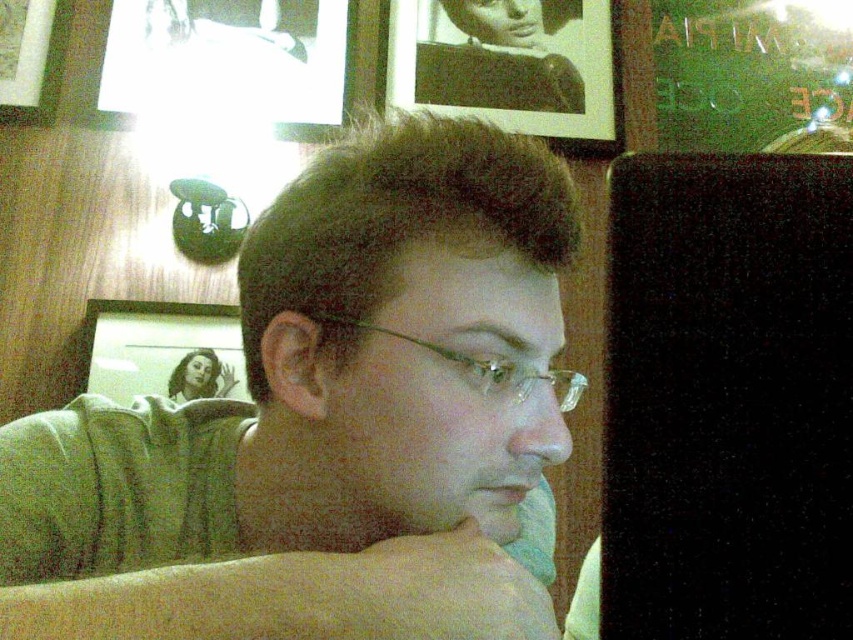
Is green matte shirt at center wider than wooden picture frame at upper left?

Yes.

Where is `green matte shirt at center`? This screenshot has height=640, width=853. green matte shirt at center is located at coordinates (328, 420).

Find the location of a particular element. Image resolution: width=853 pixels, height=640 pixels. green matte shirt at center is located at coordinates [x=328, y=420].

Looking at this image, is white paper at upper center above black paper at upper center?

No, white paper at upper center is not above black paper at upper center.

Who is positioned more to the left, white paper at upper center or black paper at upper center?

white paper at upper center

Is point (378, 68) positioned after point (592, 129)?

No, it is not.

Locate an element on the screen. white paper at upper center is located at coordinates tap(242, 61).

Can you confirm if matte glass picture frame at upper left is positioned to the left of clear plastic glasses at center?

Correct, you'll find matte glass picture frame at upper left to the left of clear plastic glasses at center.

Does matte glass picture frame at upper left have a larger size compared to clear plastic glasses at center?

Indeed, matte glass picture frame at upper left has a larger size compared to clear plastic glasses at center.

Is point (120, 378) positioned behind point (577, 381)?

Yes, it is behind point (577, 381).

Where is `matte glass picture frame at upper left`? The width and height of the screenshot is (853, 640). matte glass picture frame at upper left is located at coordinates (163, 349).